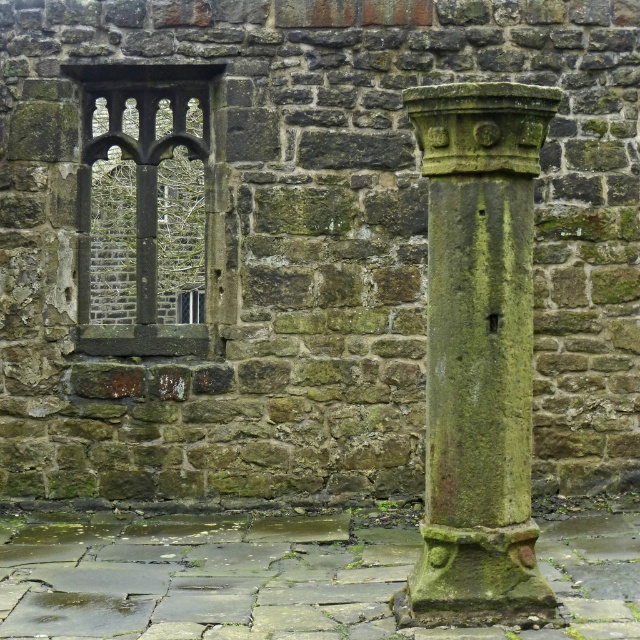
Between point (525, 396) and point (84, 96), which one is positioned behind?

The point (84, 96) is more distant.

Who is shorter, green mossy stone column at right or dark stone window at upper left?

With less height is dark stone window at upper left.

The width and height of the screenshot is (640, 640). What are the coordinates of `green mossy stone column at right` in the screenshot? It's located at (477, 349).

I want to click on green mossy stone column at right, so click(x=477, y=349).